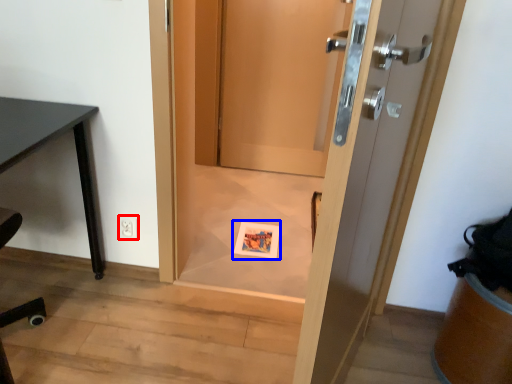
Question: Which of the following is the closest to the observer, electric outlet (highlighted by a red box) or postcard (highlighted by a blue box)?

Choices:
 (A) electric outlet
 (B) postcard

Answer: (A)